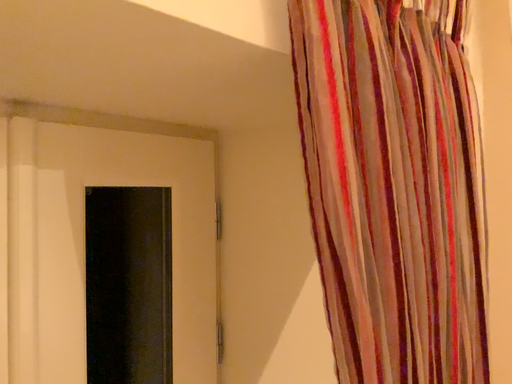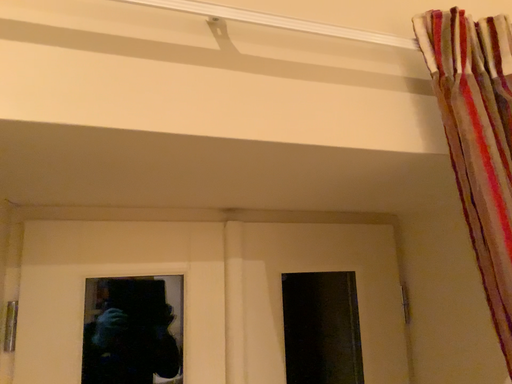
Question: Which way did the camera rotate in the video?

Choices:
 (A) rotated right
 (B) rotated left

Answer: (B)